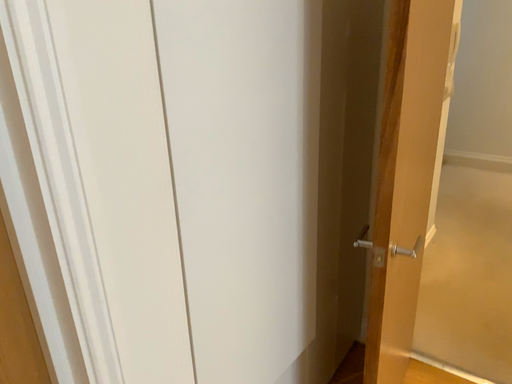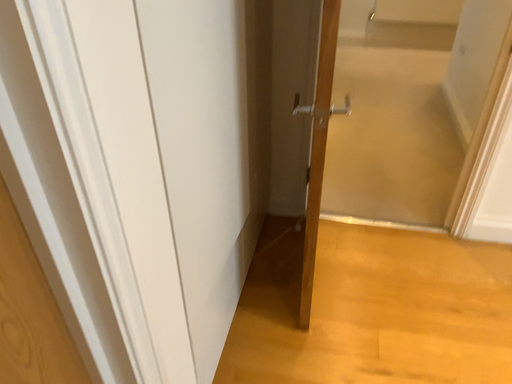
Question: Which way did the camera rotate in the video?

Choices:
 (A) rotated downward
 (B) rotated upward

Answer: (A)